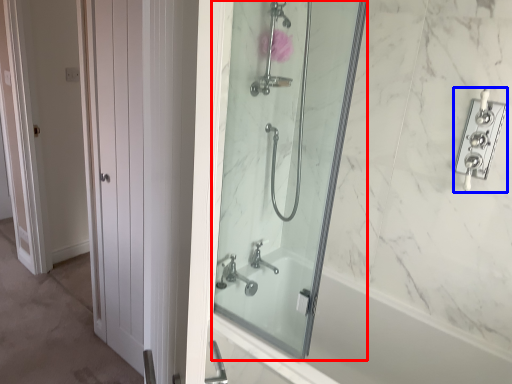
Question: Among these objects, which one is farthest to the camera, mirror (highlighted by a red box) or lock (highlighted by a blue box)?

Choices:
 (A) mirror
 (B) lock

Answer: (B)